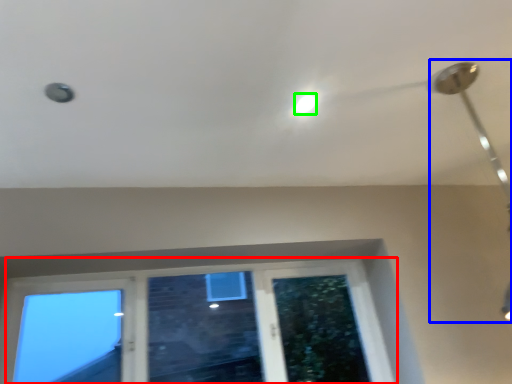
Question: Which object is positioned closest to window (highlighted by a red box)? Select from lamp (highlighted by a blue box) and droplight (highlighted by a green box).

Choices:
 (A) lamp
 (B) droplight

Answer: (B)